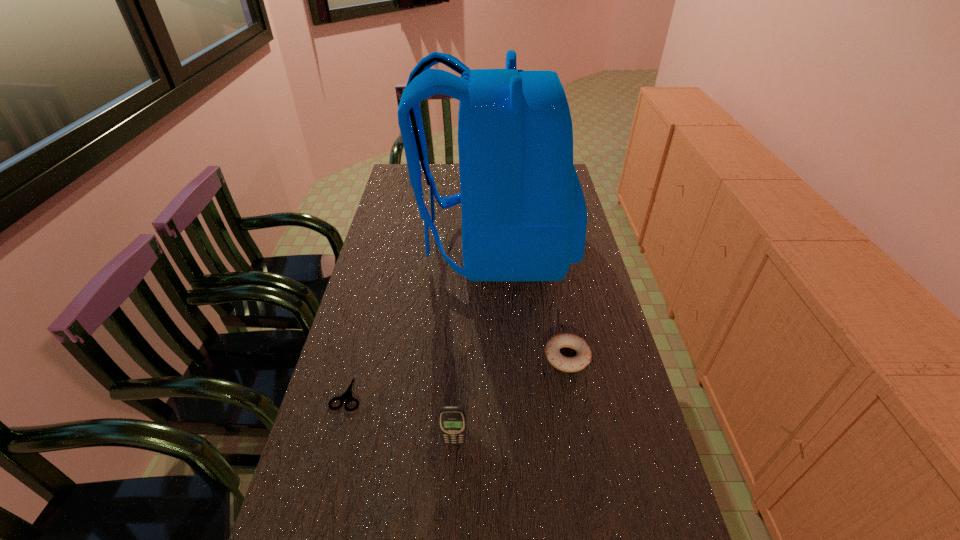
Locate an element on the screen. This screenshot has width=960, height=540. blank space located 0.260m on the back of the second shortest object is located at coordinates (552, 276).

Locate an element on the screen. This screenshot has height=540, width=960. blank space located 0.190m on the right of the leftmost object is located at coordinates (442, 393).

Image resolution: width=960 pixels, height=540 pixels. In order to click on backpack that is at the left edge in this screenshot , I will do `click(524, 216)`.

Identify the location of shears that is at the left edge. Image resolution: width=960 pixels, height=540 pixels. (347, 396).

Identify the location of backpack present at the right edge. (524, 216).

I want to click on doughnut that is at the right edge, so click(x=552, y=349).

I want to click on vacant area at the left edge of the desktop, so click(x=389, y=240).

At what (x,y) coordinates should I click in order to perform the action: click on vacant space at the right edge. Please return your answer as a coordinate pair (x, y). Looking at the image, I should click on 586,404.

This screenshot has height=540, width=960. What are the coordinates of `empty space that is in between the leftmost object and the farthest object` in the screenshot? It's located at (421, 320).

Find the location of a particular element. free point between the leftmost object and the doughnut is located at coordinates (457, 375).